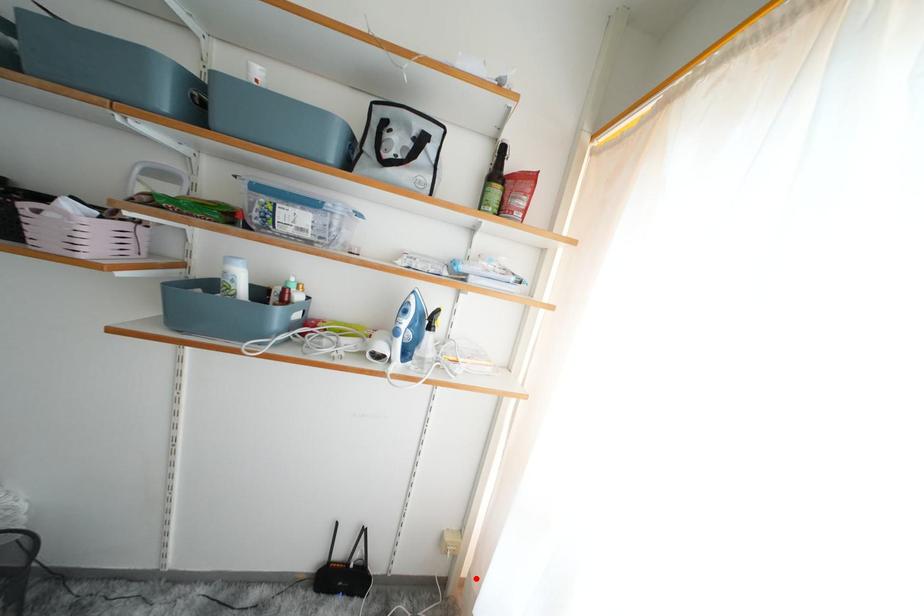
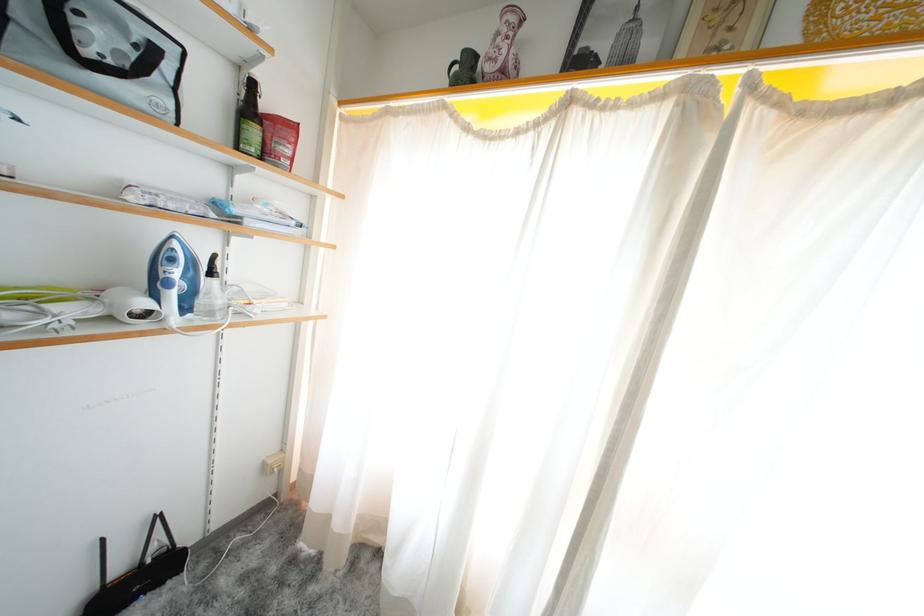
Find the pixel in the second image that matches the highlighted location in the first image.

(306, 475)